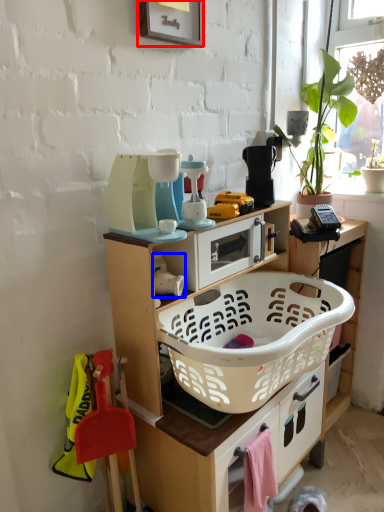
Question: Which point is further to the camera, picture frame (highlighted by a red box) or appliance (highlighted by a blue box)?

Choices:
 (A) picture frame
 (B) appliance

Answer: (B)